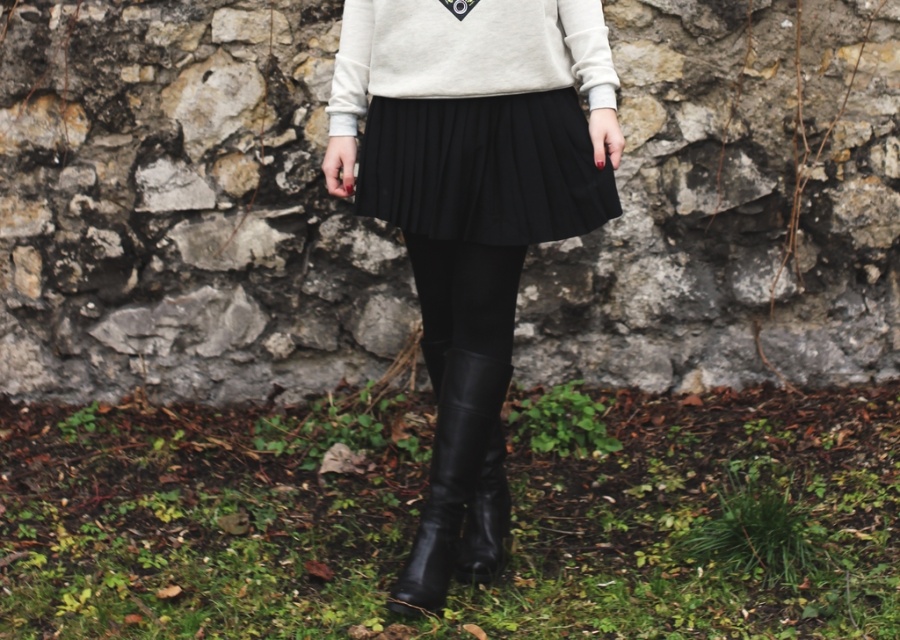
Question: Among these objects, which one is farthest from the camera?

Choices:
 (A) black leather boot at lower center
 (B) black leather skirt at center
 (C) black pleated skirt at center

Answer: (A)

Question: Does suede-like beige sweater at center appear on the right side of black leather leggings at center?

Choices:
 (A) no
 (B) yes

Answer: (B)

Question: Which object is positioned farthest from the black pleated skirt at center?

Choices:
 (A) black leather boot at lower center
 (B) black leather leggings at center
 (C) black leather skirt at center
 (D) suede-like beige sweater at center

Answer: (A)

Question: Observing the image, what is the correct spatial positioning of suede-like beige sweater at center in reference to black leather leggings at center?

Choices:
 (A) above
 (B) below

Answer: (A)

Question: Does black leather skirt at center appear on the right side of black pleated skirt at center?

Choices:
 (A) no
 (B) yes

Answer: (A)

Question: Estimate the real-world distances between objects in this image. Which object is farther from the black leather skirt at center?

Choices:
 (A) suede-like beige sweater at center
 (B) black leather boot at lower center

Answer: (B)